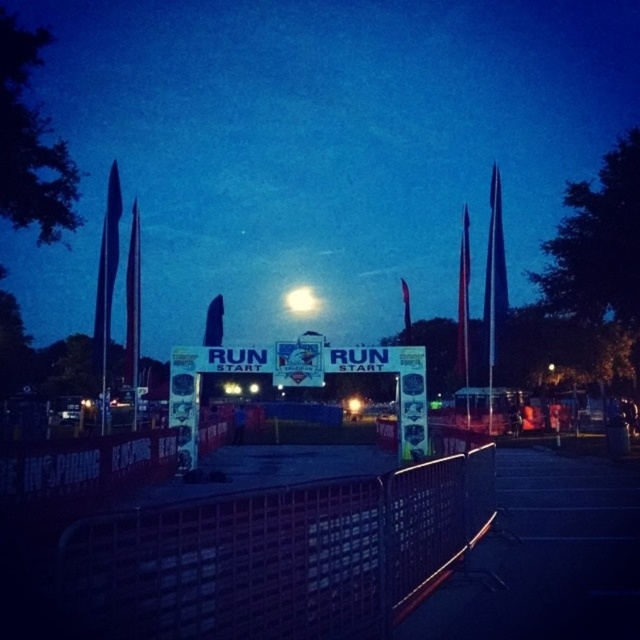
Who is shorter, white paper sign at center or bright white orb at center?

bright white orb at center is shorter.

Who is taller, white paper sign at center or bright white orb at center?

white paper sign at center

Locate an element on the screen. The width and height of the screenshot is (640, 640). white paper sign at center is located at coordinates [x=198, y=384].

Does metallic mesh fence at center have a greater height compared to white paper sign at center?

In fact, metallic mesh fence at center may be shorter than white paper sign at center.

Does metallic mesh fence at center have a lesser width compared to white paper sign at center?

Correct, metallic mesh fence at center's width is less than white paper sign at center's.

Image resolution: width=640 pixels, height=640 pixels. Identify the location of metallic mesh fence at center. (276, 556).

Measure the distance from metallic mesh fence at center to bright white orb at center.

The distance of metallic mesh fence at center from bright white orb at center is 74.54 meters.

From the picture: Is metallic mesh fence at center in front of bright white orb at center?

That is True.

Is point (248, 588) closer to camera compared to point (308, 304)?

That is True.

You are a GUI agent. You are given a task and a screenshot of the screen. Output one action in this format:
    pyautogui.click(x=<x>, y=<y>)
    Task: Click on the metallic mesh fence at center
    This screenshot has height=640, width=640.
    Given the screenshot: What is the action you would take?
    pyautogui.click(x=276, y=556)